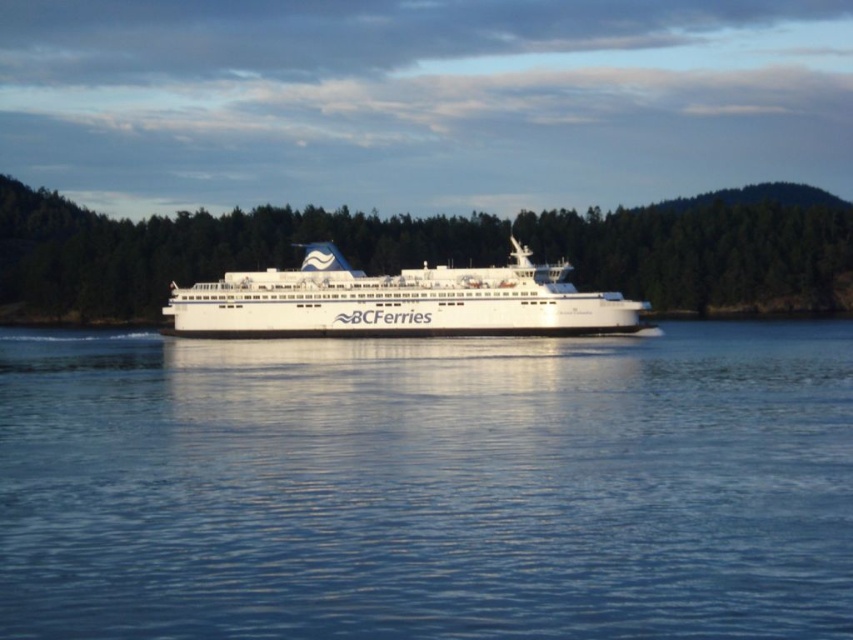
Question: Which point appears closest to the camera in this image?

Choices:
 (A) (720, 193)
 (B) (618, 536)

Answer: (B)

Question: Does blue liquid water at center lie behind green matte trees at center?

Choices:
 (A) yes
 (B) no

Answer: (B)

Question: Can you confirm if blue liquid water at center is wider than green matte trees at center?

Choices:
 (A) yes
 (B) no

Answer: (B)

Question: Which object is the closest to the white glossy ferry at center?

Choices:
 (A) blue liquid water at center
 (B) green matte trees at center

Answer: (A)

Question: Estimate the real-world distances between objects in this image. Which object is farther from the blue liquid water at center?

Choices:
 (A) green matte trees at center
 (B) white glossy ferry at center

Answer: (A)

Question: Is green matte trees at center in front of white glossy ferry at center?

Choices:
 (A) yes
 (B) no

Answer: (B)